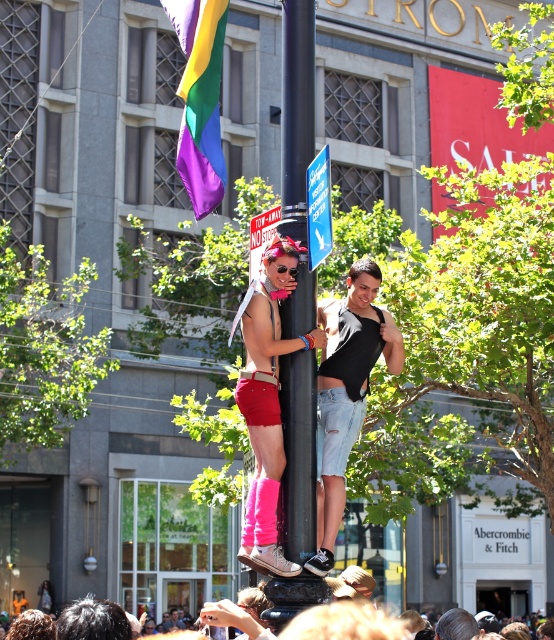
In the scene shown: Is purple fabric flag at upper left below pink satin shorts at center?

No.

Between purple fabric flag at upper left and pink satin shorts at center, which one is positioned lower?

pink satin shorts at center is below.

Where is `purple fabric flag at upper left`? The width and height of the screenshot is (554, 640). purple fabric flag at upper left is located at coordinates (199, 99).

Is black matte bikini top at upper center shorter than purple fabric flag at upper left?

Yes.

Which of these two, black matte bikini top at upper center or purple fabric flag at upper left, stands shorter?

black matte bikini top at upper center is shorter.

Image resolution: width=554 pixels, height=640 pixels. I want to click on black matte bikini top at upper center, so click(346, 392).

Does black hair at lower left have a greater width compared to pink satin shorts at center?

Correct, the width of black hair at lower left exceeds that of pink satin shorts at center.

Between point (104, 624) and point (250, 388), which one is positioned in front?

Point (104, 624) is in front.

This screenshot has width=554, height=640. I want to click on black hair at lower left, so click(x=93, y=620).

Find the location of a particular element. black hair at lower left is located at coordinates (93, 620).